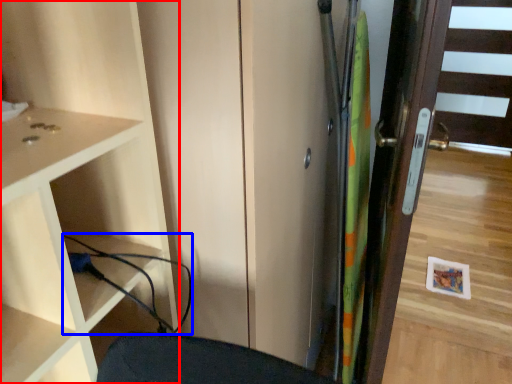
Question: Which of the following is the closest to the observer, cupboard (highlighted by a red box) or cable (highlighted by a blue box)?

Choices:
 (A) cupboard
 (B) cable

Answer: (A)